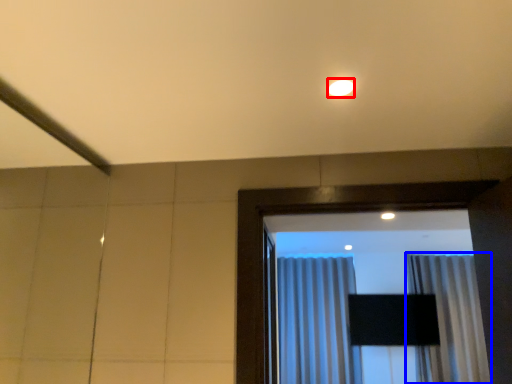
Question: Which object appears farthest to the camera in this image, lighting (highlighted by a red box) or curtain (highlighted by a blue box)?

Choices:
 (A) lighting
 (B) curtain

Answer: (B)